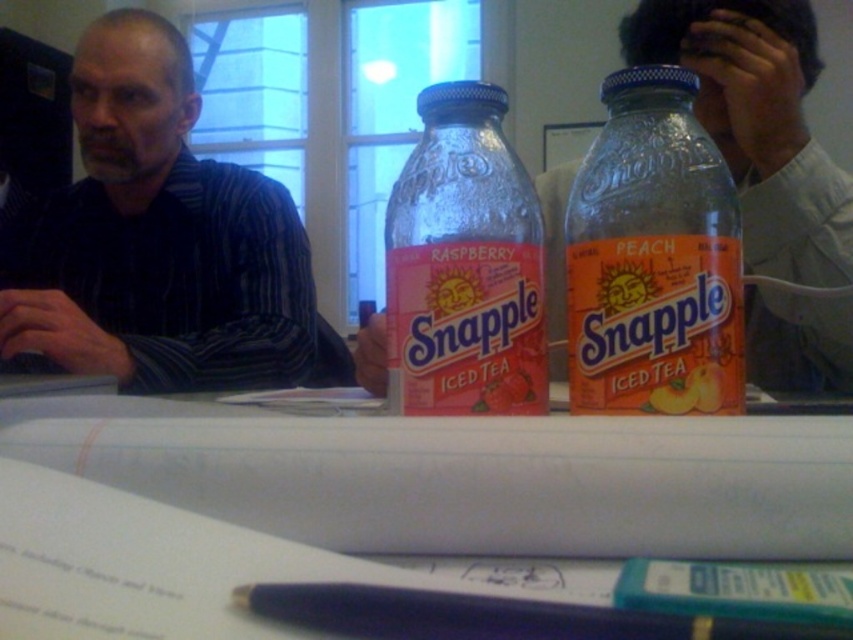
Question: Is clear glass bottle at center thinner than matte plastic snapple iced tea at center?

Choices:
 (A) no
 (B) yes

Answer: (A)

Question: Among these objects, which one is farthest from the camera?

Choices:
 (A) smooth peach snapple iced tea bottle at center
 (B) clear glass bottle at center

Answer: (A)

Question: Which point is farther to the camera?

Choices:
 (A) (479, 378)
 (B) (283, 426)
 (C) (408, 620)

Answer: (A)

Question: Can you confirm if clear glass bottle at center is positioned above smooth peach snapple iced tea bottle at center?

Choices:
 (A) yes
 (B) no

Answer: (B)

Question: Can you confirm if clear glass bottle at center is positioned above smooth peach snapple iced tea bottle at center?

Choices:
 (A) no
 (B) yes

Answer: (A)

Question: Estimate the real-world distances between objects in this image. Which object is closer to the matte plastic snapple iced tea at center?

Choices:
 (A) clear glass bottle at center
 (B) striped shirt at left

Answer: (A)